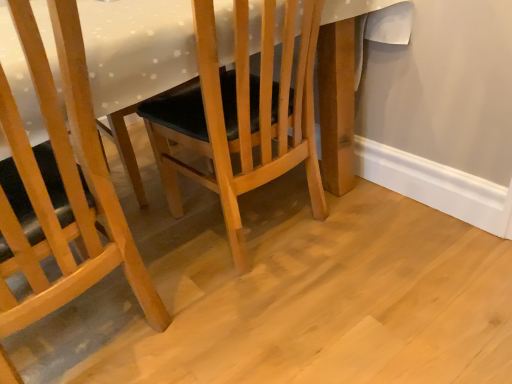
Question: From the image's perspective, is matte wood chair at center, the second chair in the right-to-left sequence, located above wooden chair at center, which is the first chair from right to left?

Choices:
 (A) yes
 (B) no

Answer: (B)

Question: Is matte wood chair at center, marked as the first chair in a left-to-right arrangement, far away from wooden chair at center, which is counted as the 2th chair, starting from the left?

Choices:
 (A) no
 (B) yes

Answer: (A)

Question: Is matte wood chair at center, the second chair in the right-to-left sequence, thinner than wooden chair at center, which is the first chair from right to left?

Choices:
 (A) no
 (B) yes

Answer: (B)

Question: Does matte wood chair at center, the second chair in the right-to-left sequence, appear on the right side of wooden chair at center, which is the first chair from right to left?

Choices:
 (A) yes
 (B) no

Answer: (B)

Question: Considering the relative sizes of matte wood chair at center, the second chair in the right-to-left sequence, and wooden chair at center, which is the first chair from right to left, in the image provided, is matte wood chair at center, the second chair in the right-to-left sequence, shorter than wooden chair at center, which is the first chair from right to left,?

Choices:
 (A) yes
 (B) no

Answer: (B)

Question: From the image's perspective, is matte wood chair at center, the second chair in the right-to-left sequence, above or below white glossy table at center?

Choices:
 (A) above
 (B) below

Answer: (B)

Question: Based on their sizes in the image, would you say matte wood chair at center, the second chair in the right-to-left sequence, is bigger or smaller than white glossy table at center?

Choices:
 (A) small
 (B) big

Answer: (A)

Question: From their relative heights in the image, would you say matte wood chair at center, marked as the first chair in a left-to-right arrangement, is taller or shorter than white glossy table at center?

Choices:
 (A) short
 (B) tall

Answer: (B)

Question: Do you think matte wood chair at center, the second chair in the right-to-left sequence, is within white glossy table at center, or outside of it?

Choices:
 (A) outside
 (B) inside

Answer: (B)

Question: In terms of height, does white glossy table at center look taller or shorter compared to matte wood chair at center, the second chair in the right-to-left sequence?

Choices:
 (A) tall
 (B) short

Answer: (B)

Question: Considering the positions of white glossy table at center and matte wood chair at center, marked as the first chair in a left-to-right arrangement, in the image, is white glossy table at center wider or thinner than matte wood chair at center, marked as the first chair in a left-to-right arrangement,?

Choices:
 (A) wide
 (B) thin

Answer: (A)

Question: Is white glossy table at center to the left or to the right of matte wood chair at center, the second chair in the right-to-left sequence, in the image?

Choices:
 (A) left
 (B) right

Answer: (B)

Question: From a real-world perspective, is white glossy table at center physically located above or below matte wood chair at center, the second chair in the right-to-left sequence?

Choices:
 (A) below
 (B) above

Answer: (A)

Question: Which is correct: white glossy table at center is inside wooden chair at center, which is counted as the 2th chair, starting from the left, or outside of it?

Choices:
 (A) inside
 (B) outside

Answer: (B)

Question: In the image, is white glossy table at center on the left side or the right side of wooden chair at center, which is counted as the 2th chair, starting from the left?

Choices:
 (A) left
 (B) right

Answer: (A)